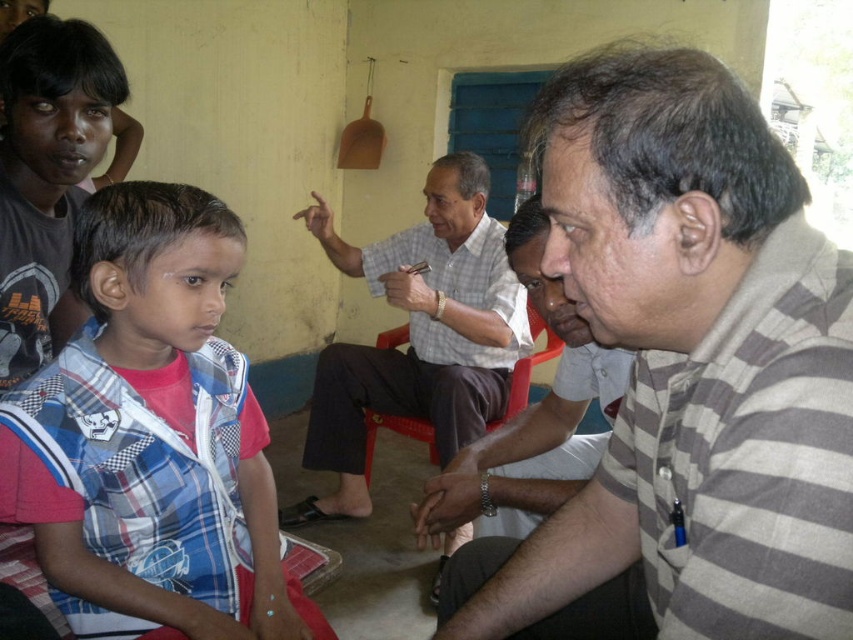
You are a person who needs to pass between the gray striped shirt at center and the striped cotton shirt at center. The space between them is narrow. Can you safely walk through the gap without touching either of them if you have a shoulder width of 18 inches?

The gray striped shirt at center is 19.78 inches away from the striped cotton shirt at center. Subtracting your shoulder width of 18 inches, there is 1.78 inches of clearance. This minimal space might make it difficult to pass without touching either shirt, so proceed with caution.

Looking at this image, you are attending a meeting in this room and need to sit down. There is a striped cotton shirt at center and a red plastic chair at center. Which object should you approach to sit?

The red plastic chair at center is the object you should approach to sit. The striped cotton shirt at center is positioned on the right side of the red plastic chair at center, indicating it belongs to someone already seated on the chair.

You are organizing a workshop in this room and need to ensure there is enough space for all participants. Given the striped cotton shirt at center and the red plastic chair at center, which object takes up more physical space in the scene?

The red plastic chair at center takes up more physical space than the striped cotton shirt at center, as the striped cotton shirt at center occupies less space than the red plastic chair at center.